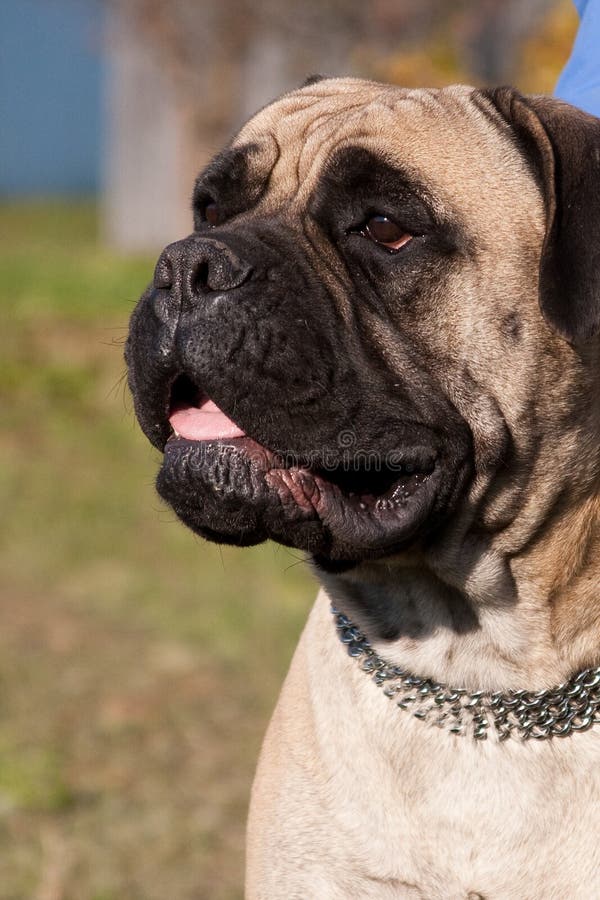
Find the location of a particular element. The image size is (600, 900). chair is located at coordinates (525, 713).